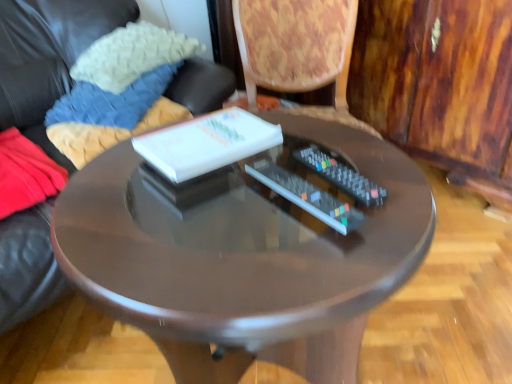
You are a GUI agent. You are given a task and a screenshot of the screen. Output one action in this format:
    pyautogui.click(x=<x>, y=<y>)
    Task: Click on the free spot behind matte black remote control at center, the first remote control positioned from the left
    The image size is (512, 384).
    Given the screenshot: What is the action you would take?
    pyautogui.click(x=318, y=145)